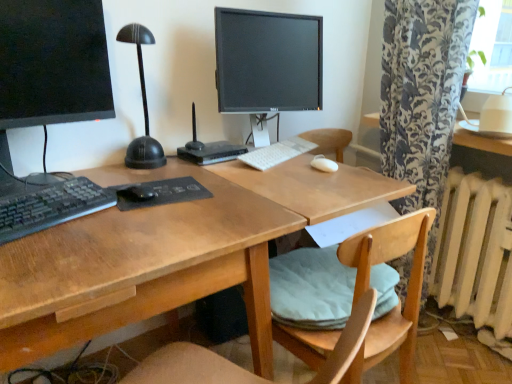
Question: Is matte black monitor at center, acting as the second computer monitor starting from the front, at the left side of white matte mouse at center?

Choices:
 (A) no
 (B) yes

Answer: (B)

Question: Does matte black monitor at center, acting as the second computer monitor starting from the front, appear on the right side of white matte mouse at center?

Choices:
 (A) yes
 (B) no

Answer: (B)

Question: Is matte black monitor at center, placed as the second computer monitor when sorted from left to right, not close to white matte mouse at center?

Choices:
 (A) yes
 (B) no

Answer: (B)

Question: From the image's perspective, is matte black monitor at center, which appears as the 1th computer monitor when viewed from the right, located beneath white matte mouse at center?

Choices:
 (A) yes
 (B) no

Answer: (B)

Question: Is matte black monitor at center, the first computer monitor from the back, located outside white matte mouse at center?

Choices:
 (A) yes
 (B) no

Answer: (A)

Question: Is white plastic keyboard at center inside the boundaries of light wood chair at center, or outside?

Choices:
 (A) inside
 (B) outside

Answer: (B)

Question: Would you say white plastic keyboard at center is to the left or to the right of light wood chair at center in the picture?

Choices:
 (A) left
 (B) right

Answer: (A)

Question: From the image's perspective, is white plastic keyboard at center positioned above or below light wood chair at center?

Choices:
 (A) below
 (B) above

Answer: (B)

Question: In the image, is white plastic keyboard at center positioned in front of or behind light wood chair at center?

Choices:
 (A) behind
 (B) front

Answer: (A)

Question: Considering the positions of point (105, 195) and point (417, 246), is point (105, 195) closer or farther from the camera than point (417, 246)?

Choices:
 (A) closer
 (B) farther

Answer: (A)

Question: From the image's perspective, relative to light wood chair at center, is translucent plastic keyboard at left above or below?

Choices:
 (A) below
 (B) above

Answer: (B)

Question: Looking at their shapes, would you say translucent plastic keyboard at left is wider or thinner than light wood chair at center?

Choices:
 (A) wide
 (B) thin

Answer: (B)

Question: In the image, is translucent plastic keyboard at left on the left side or the right side of light wood chair at center?

Choices:
 (A) left
 (B) right

Answer: (A)

Question: Do you think light wood chair at center is within black plastic router at center, or outside of it?

Choices:
 (A) inside
 (B) outside

Answer: (B)

Question: In terms of size, does light wood chair at center appear bigger or smaller than black plastic router at center?

Choices:
 (A) small
 (B) big

Answer: (B)